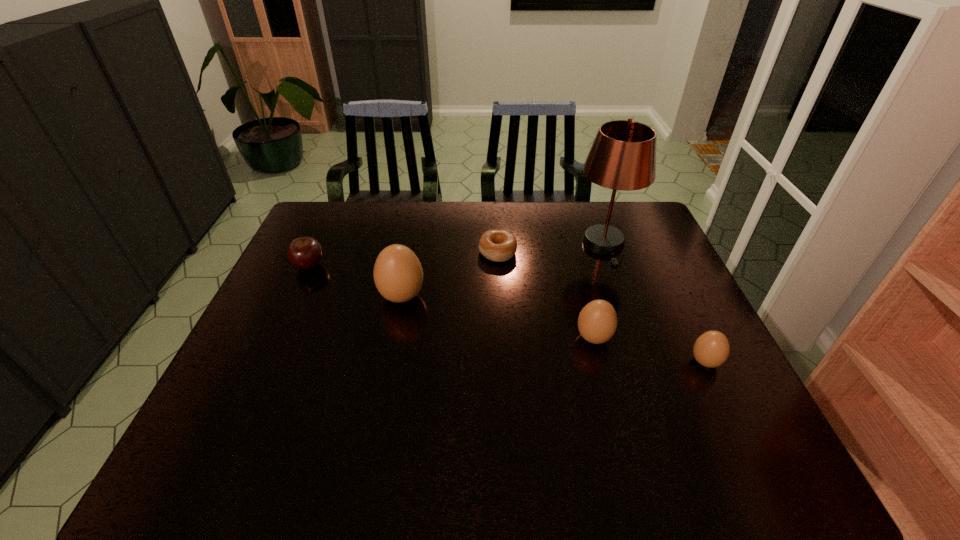
Locate an element on the screen. free space between the fourth object from right to left and the second tallest boiled egg is located at coordinates (545, 295).

Image resolution: width=960 pixels, height=540 pixels. In order to click on vacant space that is in between the lampshade and the apple in this screenshot , I will do point(456,255).

Identify the location of vacant space that is in between the second boiled egg from right to left and the tallest object. (599, 291).

Where is `object that stands as the fifth closest to the leftmost object`? This screenshot has height=540, width=960. object that stands as the fifth closest to the leftmost object is located at coordinates (711, 349).

This screenshot has width=960, height=540. Identify the location of object that is the closest to the fifth object from right to left. (496, 245).

Identify which boiled egg is located as the second nearest to the second boiled egg from right to left. Please provide its 2D coordinates. Your answer should be formatted as a tuple, i.e. [(x, y)], where the tuple contains the x and y coordinates of a point satisfying the conditions above.

[(398, 275)]

Image resolution: width=960 pixels, height=540 pixels. Identify the location of boiled egg that is the closest to the third nearest object. (597, 322).